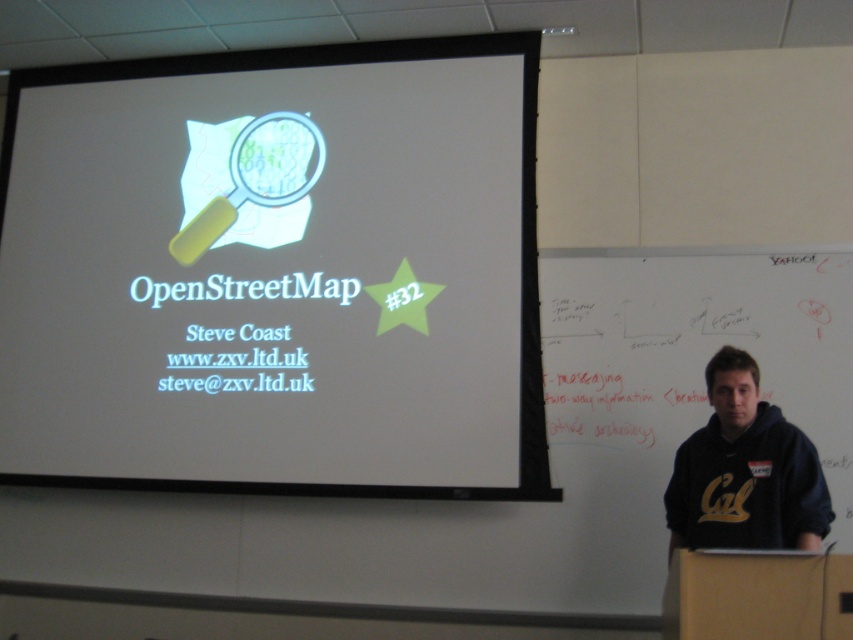
Question: Among these points, which one is farthest from the camera?

Choices:
 (A) (157, 321)
 (B) (718, 506)

Answer: (A)

Question: Can you confirm if white matte projection screen at upper center is positioned to the right of dark blue hoodie at right?

Choices:
 (A) no
 (B) yes

Answer: (A)

Question: Does white matte projection screen at upper center appear over dark blue hoodie at right?

Choices:
 (A) yes
 (B) no

Answer: (A)

Question: Which point is farther to the camera?

Choices:
 (A) (720, 544)
 (B) (276, 362)

Answer: (B)

Question: Which of these objects is positioned farthest from the whiteboard at right?

Choices:
 (A) dark blue hoodie at right
 (B) white matte projection screen at upper center

Answer: (B)

Question: Can you confirm if white matte projection screen at upper center is wider than dark blue hoodie at right?

Choices:
 (A) yes
 (B) no

Answer: (A)